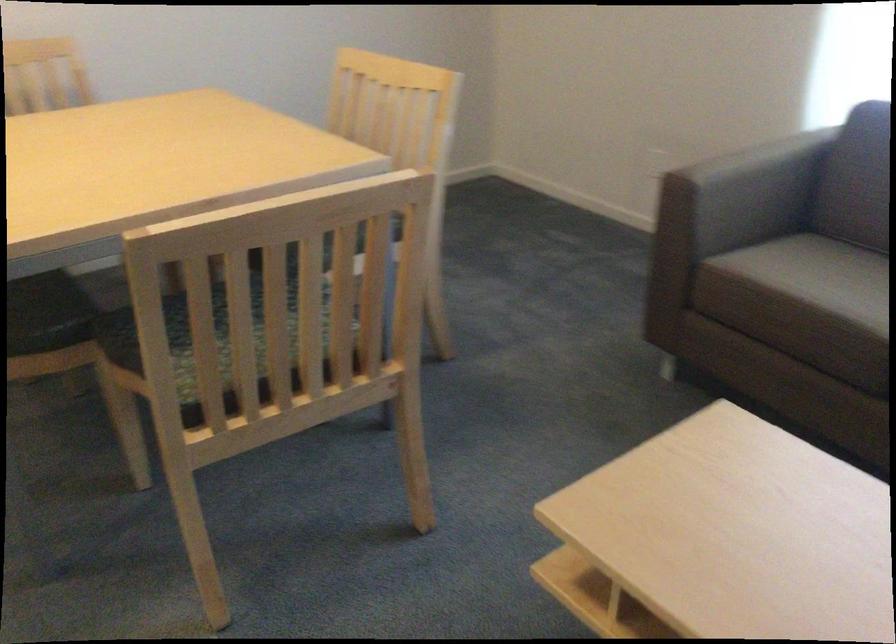
The image size is (896, 644). What do you see at coordinates (746, 192) in the screenshot? I see `a brown sofa armrest` at bounding box center [746, 192].